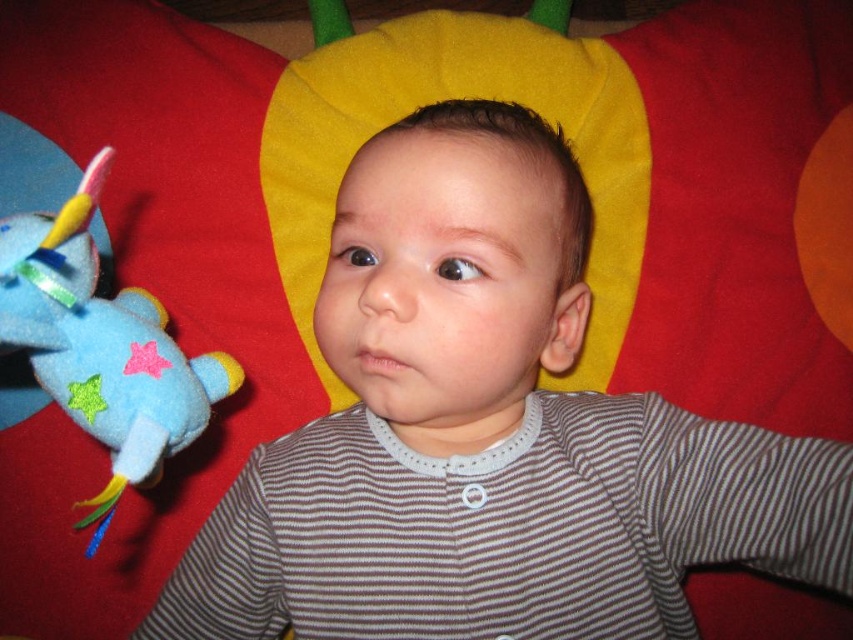
Can you confirm if gray striped shirt at center is positioned to the left of blue felt airplane at left?

In fact, gray striped shirt at center is to the right of blue felt airplane at left.

Is the position of gray striped shirt at center more distant than that of blue felt airplane at left?

No, it is in front of blue felt airplane at left.

Locate an element on the screen. The height and width of the screenshot is (640, 853). gray striped shirt at center is located at coordinates (488, 433).